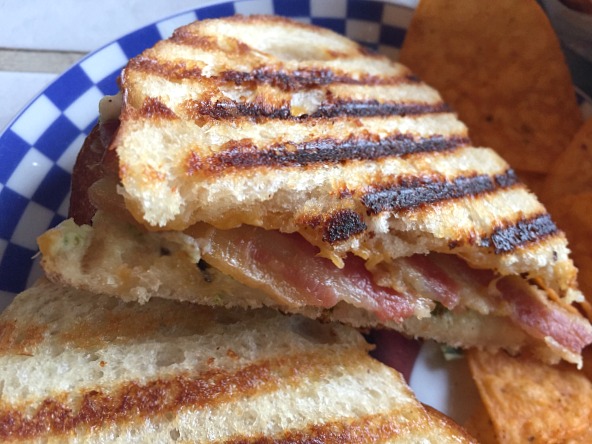
I want to click on plate, so click(44, 116).